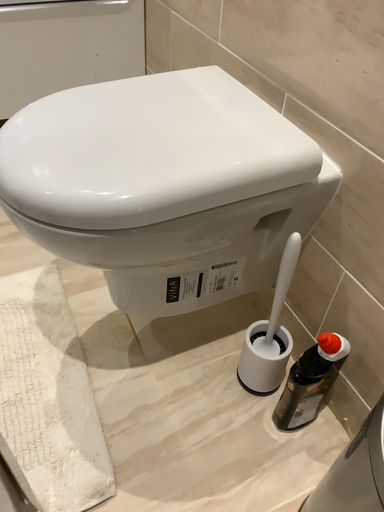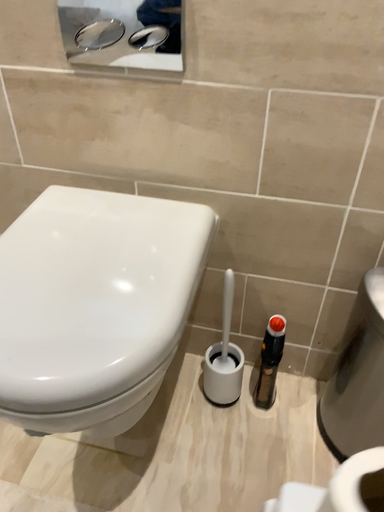
Question: Which way did the camera rotate in the video?

Choices:
 (A) rotated left
 (B) rotated right

Answer: (B)